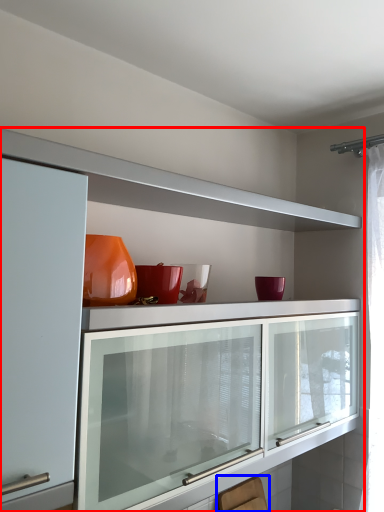
Question: Which object is further to the camera taking this photo, cabinetry (highlighted by a red box) or swivel chair (highlighted by a blue box)?

Choices:
 (A) cabinetry
 (B) swivel chair

Answer: (B)